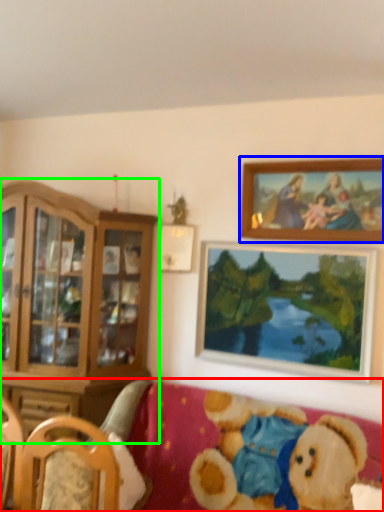
Question: Which object is the farthest from studio couch (highlighted by a red box)? Choose among these: picture frame (highlighted by a blue box) or cabinetry (highlighted by a green box).

Choices:
 (A) picture frame
 (B) cabinetry

Answer: (A)